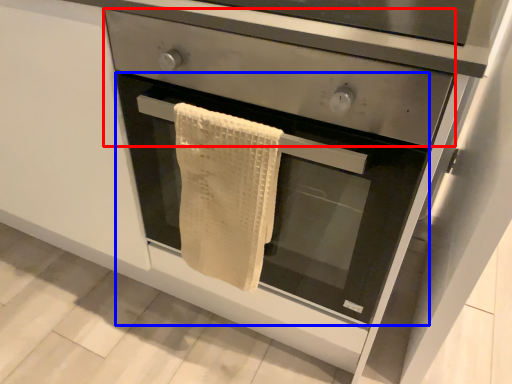
Question: Among these objects, which one is nearest to the camera, drawer (highlighted by a red box) or oven (highlighted by a blue box)?

Choices:
 (A) drawer
 (B) oven

Answer: (A)